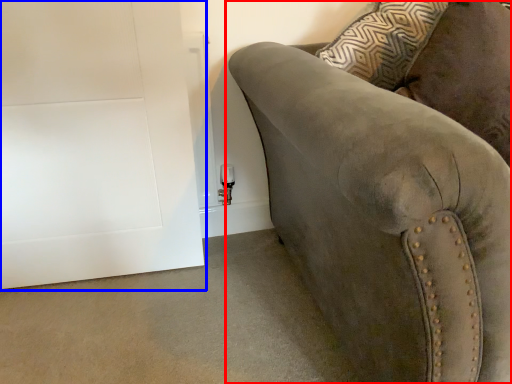
Question: Among these objects, which one is nearest to the camera, studio couch (highlighted by a red box) or door (highlighted by a blue box)?

Choices:
 (A) studio couch
 (B) door

Answer: (A)